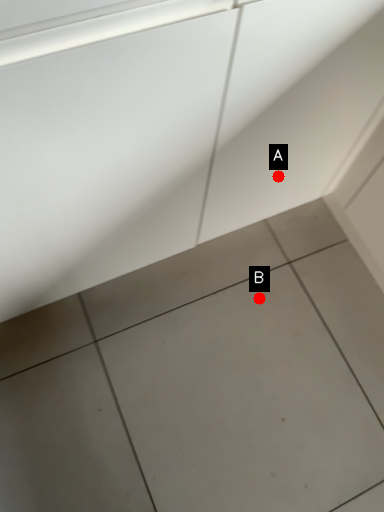
Question: Two points are circled on the image, labeled by A and B beside each circle. Which point is closer to the camera taking this photo?

Choices:
 (A) A is closer
 (B) B is closer

Answer: (A)